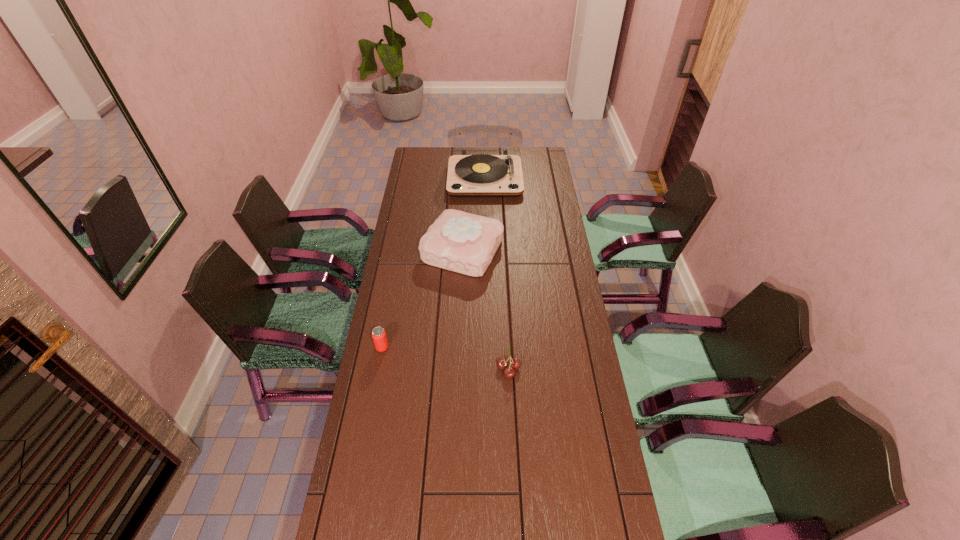
Identify the location of vacant space located 0.350m on the right of the beer can. (489, 348).

Identify the location of free location located 0.160m on the leaves of the shortest object. point(449,368).

This screenshot has height=540, width=960. In order to click on vacant position located on the leaves of the shortest object in this screenshot , I will do `click(482, 368)`.

At what (x,y) coordinates should I click in order to perform the action: click on free region located on the leaves of the shortest object. Please return your answer as a coordinate pair (x, y). Image resolution: width=960 pixels, height=540 pixels. Looking at the image, I should click on (428, 368).

Where is `object that is positioned at the far edge`? The height and width of the screenshot is (540, 960). object that is positioned at the far edge is located at coordinates (480, 175).

Locate an element on the screen. This screenshot has width=960, height=540. cake present at the left edge is located at coordinates (458, 241).

Where is `beer can present at the left edge`? The width and height of the screenshot is (960, 540). beer can present at the left edge is located at coordinates (378, 334).

Identify the location of object at the right edge. (480, 175).

Image resolution: width=960 pixels, height=540 pixels. What are the coordinates of `object situated at the far right corner` in the screenshot? It's located at (480, 175).

In the image, there is a desktop. Identify the location of vacant space at the far edge. The image size is (960, 540). (491, 155).